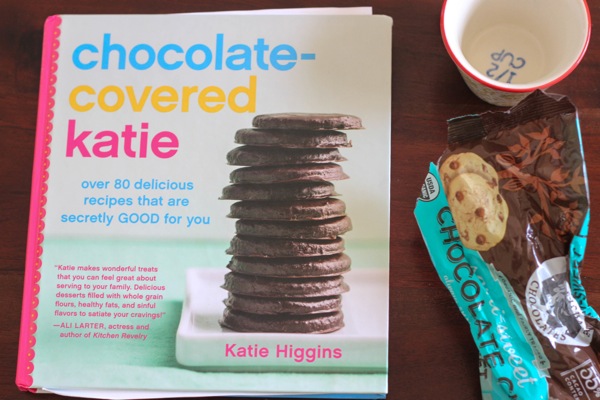
The height and width of the screenshot is (400, 600). What are the coordinates of `measuring cup` in the screenshot? It's located at coord(518,41).